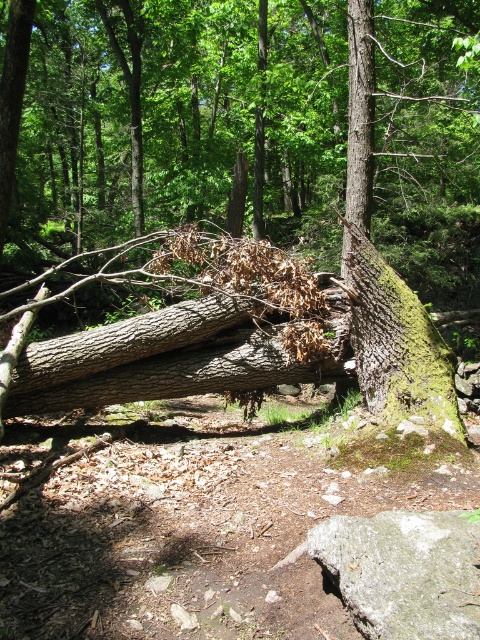
Based on the photo, is gray rough rock at lower right positioned at the back of green mossy tree trunk at center?

No, gray rough rock at lower right is in front of green mossy tree trunk at center.

Does gray rough rock at lower right have a greater width compared to green mossy tree trunk at center?

In fact, gray rough rock at lower right might be narrower than green mossy tree trunk at center.

Is point (360, 611) closer to viewer compared to point (361, 256)?

That is True.

At what (x,y) coordinates should I click in order to perform the action: click on gray rough rock at lower right. Please return your answer as a coordinate pair (x, y). The width and height of the screenshot is (480, 640). Looking at the image, I should click on (404, 572).